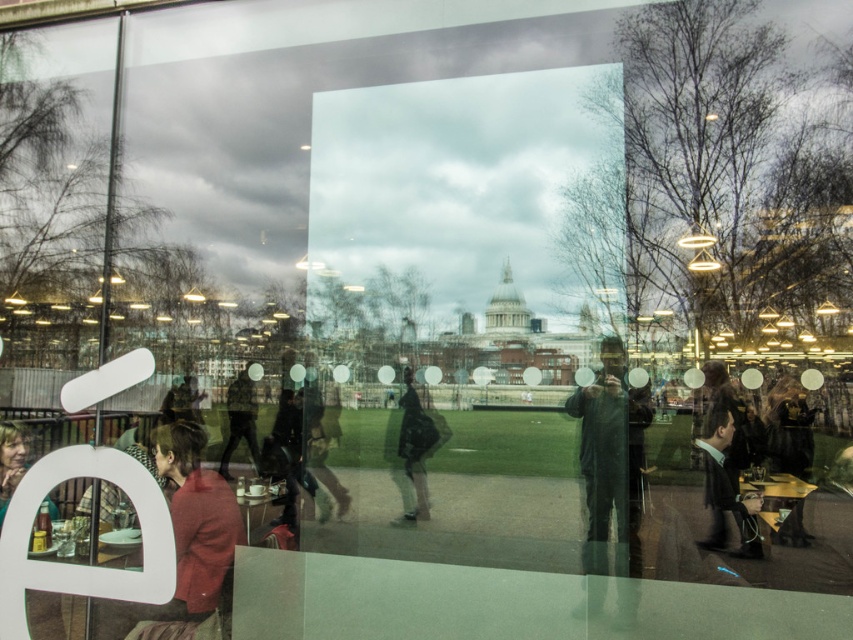
Does matte red coat at lower left have a lesser height compared to matte black jacket at lower left?

No.

Who is more forward, (196, 433) or (19, 461)?

Point (19, 461) is more forward.

What do you see at coordinates (194, 534) in the screenshot? The width and height of the screenshot is (853, 640). I see `matte red coat at lower left` at bounding box center [194, 534].

I want to click on matte red coat at lower left, so click(x=194, y=534).

How much distance is there between dark gray jacket at center and matte black jacket at lower left?

21.23 feet

Which of these two, dark gray jacket at center or matte black jacket at lower left, stands shorter?

Standing shorter between the two is matte black jacket at lower left.

Describe the element at coordinates (607, 477) in the screenshot. I see `dark gray jacket at center` at that location.

At what (x,y) coordinates should I click in order to perform the action: click on dark gray jacket at center. Please return your answer as a coordinate pair (x, y). The width and height of the screenshot is (853, 640). Looking at the image, I should click on (607, 477).

Which is more to the left, dark gray jacket at center or dark suit at right?

Positioned to the left is dark suit at right.

Does dark gray jacket at center have a greater width compared to dark suit at right?

Yes, dark gray jacket at center is wider than dark suit at right.

The height and width of the screenshot is (640, 853). I want to click on dark gray jacket at center, so (607, 477).